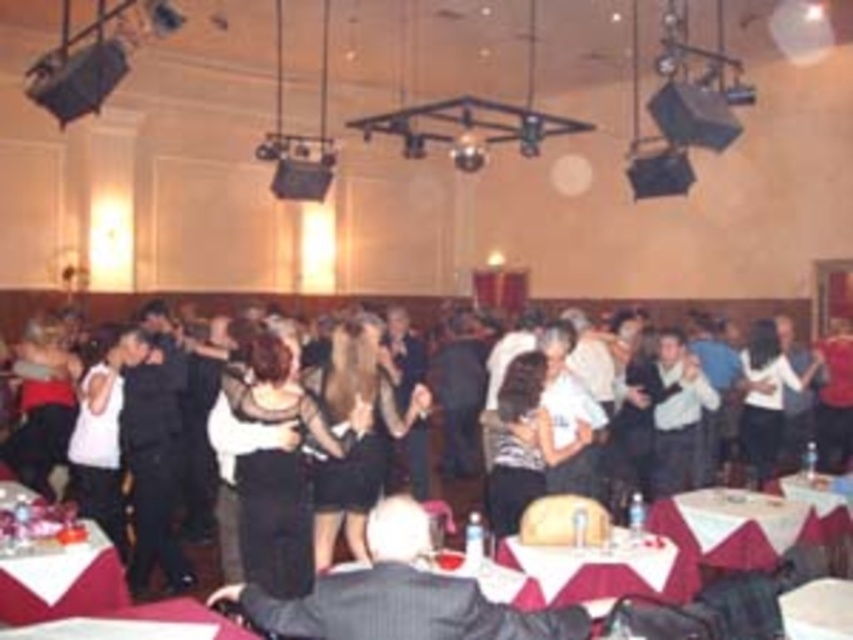
Does white tablecloth at lower center have a smaller size compared to smooth white table at lower center?

Incorrect, white tablecloth at lower center is not smaller in size than smooth white table at lower center.

The height and width of the screenshot is (640, 853). What do you see at coordinates (604, 568) in the screenshot? I see `white tablecloth at lower center` at bounding box center [604, 568].

Describe the element at coordinates (604, 568) in the screenshot. Image resolution: width=853 pixels, height=640 pixels. I see `white tablecloth at lower center` at that location.

The image size is (853, 640). I want to click on white tablecloth at lower center, so click(x=604, y=568).

What do you see at coordinates (271, 305) in the screenshot?
I see `black satin dress at center` at bounding box center [271, 305].

Is black satin dress at center taller than white tablecloth at lower center?

Correct, black satin dress at center is much taller as white tablecloth at lower center.

Which is in front, point (804, 326) or point (688, 570)?

Positioned in front is point (688, 570).

Locate an element on the screen. black satin dress at center is located at coordinates (271, 305).

Is dark gray suit at lower center to the left of black satin dress at center from the viewer's perspective?

Correct, you'll find dark gray suit at lower center to the left of black satin dress at center.

Between dark gray suit at lower center and black satin dress at center, which one has less height?

Standing shorter between the two is dark gray suit at lower center.

What do you see at coordinates (399, 595) in the screenshot? I see `dark gray suit at lower center` at bounding box center [399, 595].

You are a GUI agent. You are given a task and a screenshot of the screen. Output one action in this format:
    pyautogui.click(x=<x>, y=<y>)
    Task: Click on the dark gray suit at lower center
    Image resolution: width=853 pixels, height=640 pixels.
    Given the screenshot: What is the action you would take?
    pyautogui.click(x=399, y=595)